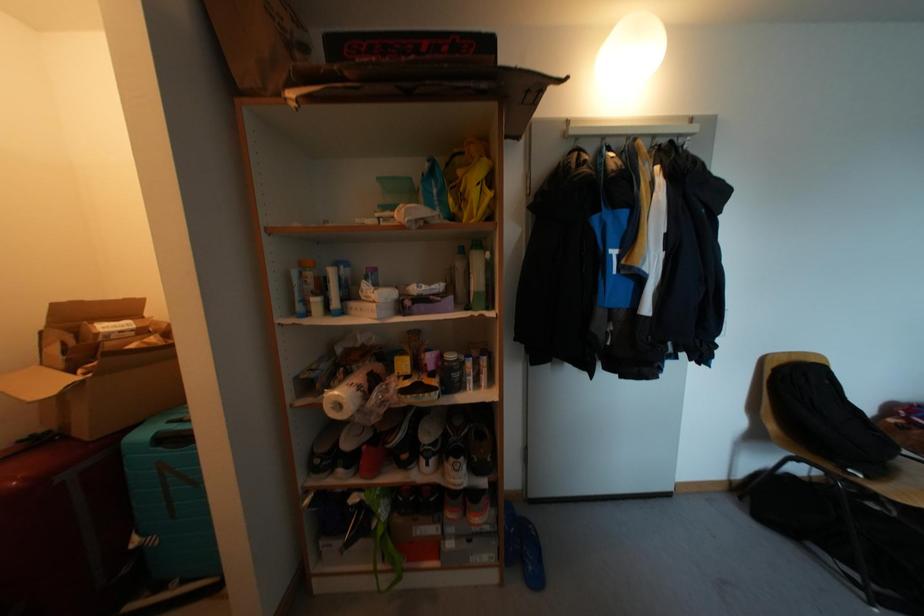
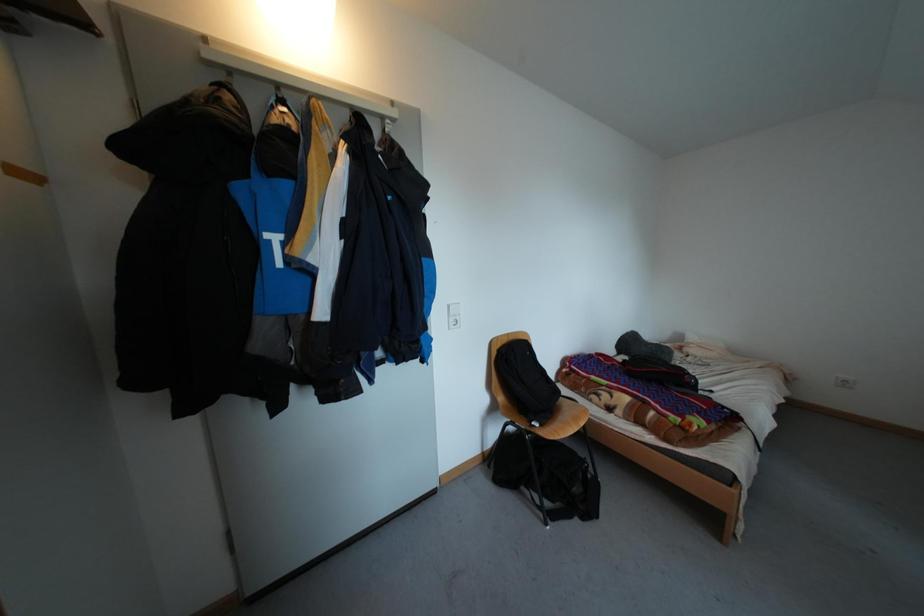
Question: How did the camera likely rotate?

Choices:
 (A) Left
 (B) Right
 (C) Up
 (D) Down

Answer: (B)